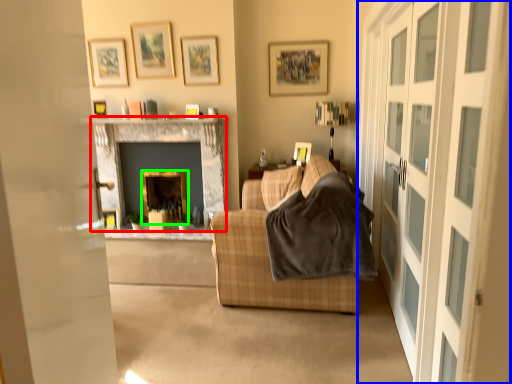
Question: Estimate the real-world distances between objects in this image. Which object is closer to fireplace (highlighted by a red box), glass door (highlighted by a blue box) or fireplace (highlighted by a green box)?

Choices:
 (A) glass door
 (B) fireplace

Answer: (B)